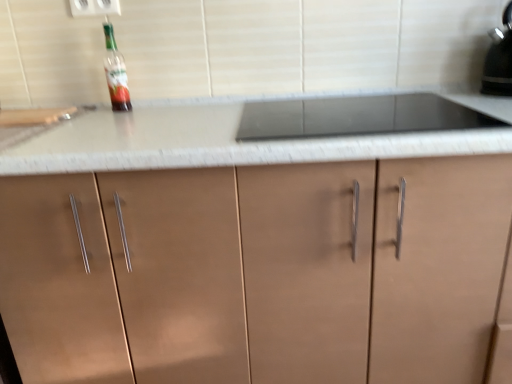
Question: From the image's perspective, is white plastic electric outlet at upper center located above or below translucent glass bottle at upper left?

Choices:
 (A) above
 (B) below

Answer: (A)

Question: Based on their sizes in the image, would you say white plastic electric outlet at upper center is bigger or smaller than translucent glass bottle at upper left?

Choices:
 (A) small
 (B) big

Answer: (A)

Question: Which of these objects is positioned farthest from the translucent glass bottle at upper left?

Choices:
 (A) black glossy kettle at upper right
 (B) matte brown cabinet at center
 (C) white plastic electric outlet at upper center

Answer: (A)

Question: Which is farther from the white plastic electric outlet at upper center?

Choices:
 (A) translucent glass bottle at upper left
 (B) matte brown cabinet at center
 (C) black glossy kettle at upper right

Answer: (C)